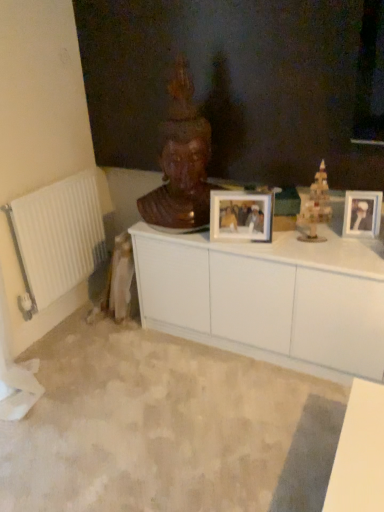
Question: From the image's perspective, does white glossy picture frame at center, acting as the second picture frame starting from the right, appear lower than wooden statue at center?

Choices:
 (A) no
 (B) yes

Answer: (B)

Question: From a real-world perspective, does white glossy picture frame at center, the first picture frame in the left-to-right sequence, sit lower than wooden statue at center?

Choices:
 (A) yes
 (B) no

Answer: (A)

Question: Is white glossy picture frame at center, acting as the second picture frame starting from the right, bigger than wooden statue at center?

Choices:
 (A) yes
 (B) no

Answer: (B)

Question: From the image's perspective, is white glossy picture frame at center, the first picture frame in the left-to-right sequence, located above wooden statue at center?

Choices:
 (A) no
 (B) yes

Answer: (A)

Question: Is white glossy picture frame at center, the first picture frame in the left-to-right sequence, positioned behind wooden statue at center?

Choices:
 (A) yes
 (B) no

Answer: (A)

Question: Based on their positions, is white matte cabinet at center located to the left or right of white glossy picture frame at center, acting as the second picture frame starting from the right?

Choices:
 (A) left
 (B) right

Answer: (B)

Question: Is white matte cabinet at center in front of or behind white glossy picture frame at center, the first picture frame in the left-to-right sequence, in the image?

Choices:
 (A) front
 (B) behind

Answer: (A)

Question: From their relative heights in the image, would you say white matte cabinet at center is taller or shorter than white glossy picture frame at center, the first picture frame in the left-to-right sequence?

Choices:
 (A) tall
 (B) short

Answer: (A)

Question: Is white matte cabinet at center inside the boundaries of white glossy picture frame at center, acting as the second picture frame starting from the right, or outside?

Choices:
 (A) inside
 (B) outside

Answer: (B)

Question: Considering the positions of white metal radiator at left and wooden statue at center in the image, is white metal radiator at left taller or shorter than wooden statue at center?

Choices:
 (A) short
 (B) tall

Answer: (A)

Question: From a real-world perspective, relative to wooden statue at center, is white metal radiator at left vertically above or below?

Choices:
 (A) above
 (B) below

Answer: (B)

Question: Relative to wooden statue at center, is white metal radiator at left in front or behind?

Choices:
 (A) front
 (B) behind

Answer: (B)

Question: From the image's perspective, relative to wooden statue at center, is white metal radiator at left above or below?

Choices:
 (A) below
 (B) above

Answer: (A)

Question: Which is correct: white plastic picture frame at upper right, the 1th picture frame viewed from the right, is inside white glossy picture frame at center, the first picture frame in the left-to-right sequence, or outside of it?

Choices:
 (A) inside
 (B) outside

Answer: (B)

Question: Is white plastic picture frame at upper right, the 1th picture frame viewed from the right, bigger or smaller than white glossy picture frame at center, the first picture frame in the left-to-right sequence?

Choices:
 (A) big
 (B) small

Answer: (B)